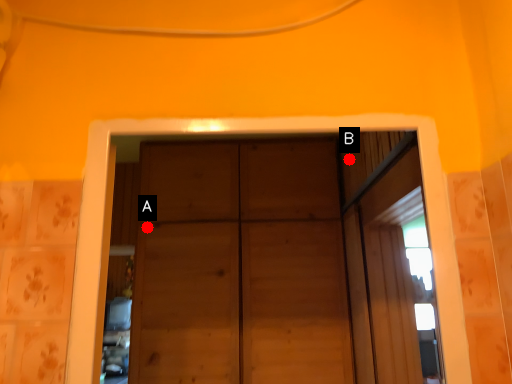
Question: Two points are circled on the image, labeled by A and B beside each circle. Which point is farther to the camera?

Choices:
 (A) A is further
 (B) B is further

Answer: (A)